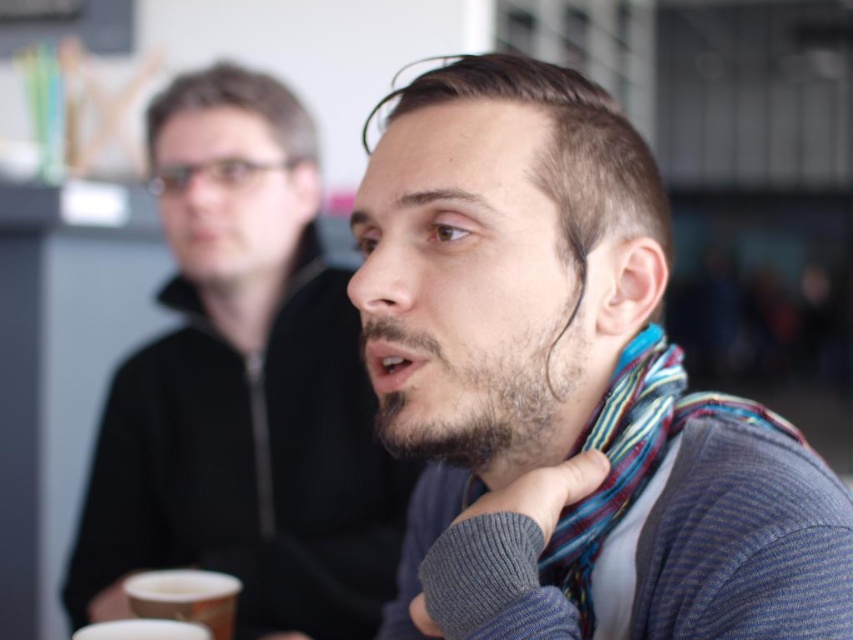
Question: In this image, where is striped scarf at center located relative to white paper cup at lower left?

Choices:
 (A) above
 (B) below

Answer: (A)

Question: Which is nearer to the white paper cup at lower left?

Choices:
 (A) striped scarf at center
 (B) matte black jacket at center

Answer: (A)

Question: Is matte black jacket at center below white paper cup at lower left?

Choices:
 (A) no
 (B) yes

Answer: (A)

Question: Does striped fabric scarf at center appear on the left side of white paper cup at lower left?

Choices:
 (A) yes
 (B) no

Answer: (B)

Question: Which object is the farthest from the striped scarf at center?

Choices:
 (A) striped fabric scarf at center
 (B) white paper cup at lower left

Answer: (B)

Question: Among these points, which one is farthest from the camera?

Choices:
 (A) (180, 586)
 (B) (703, 525)
 (C) (689, 413)

Answer: (A)